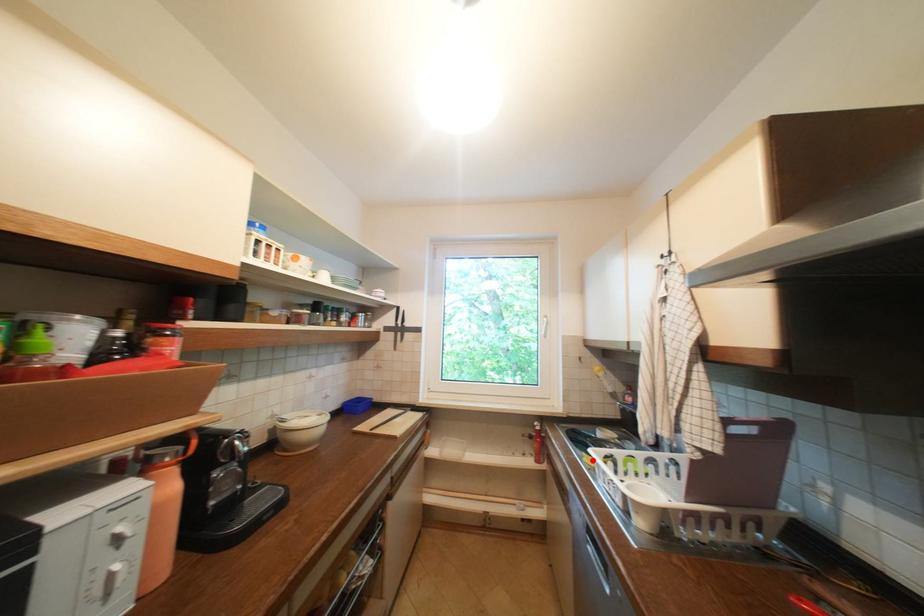
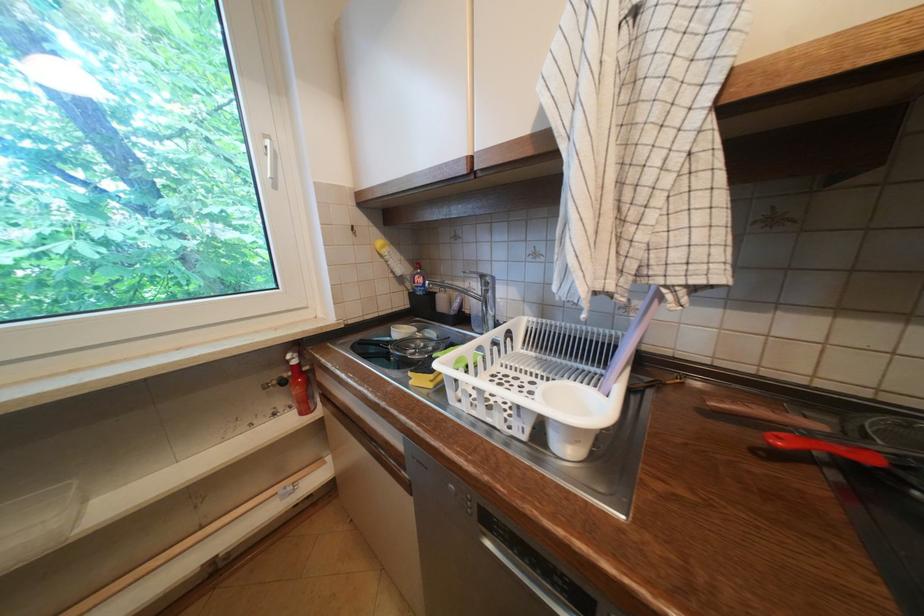
The point at the highlighted location is marked in the first image. Where is the corresponding point in the second image?

(419, 383)